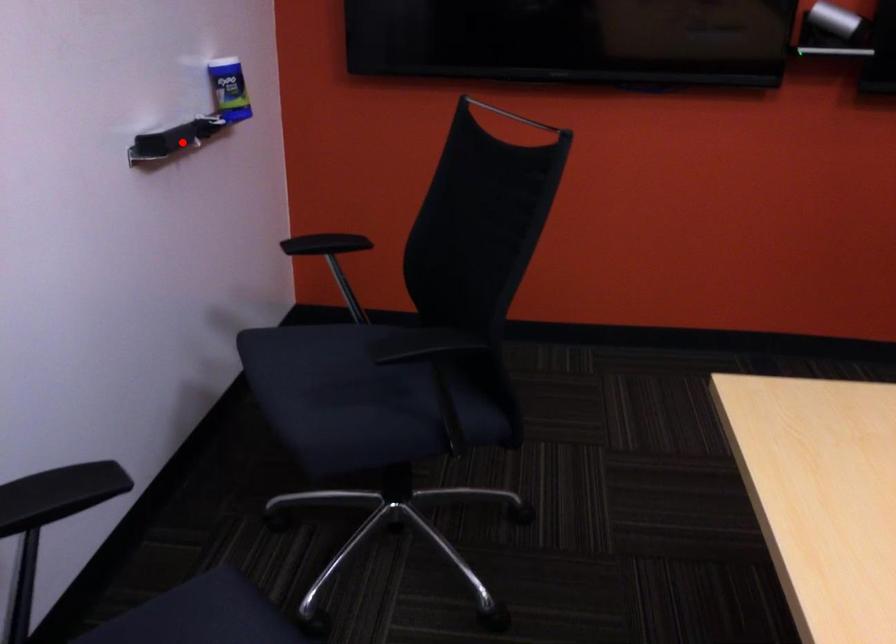
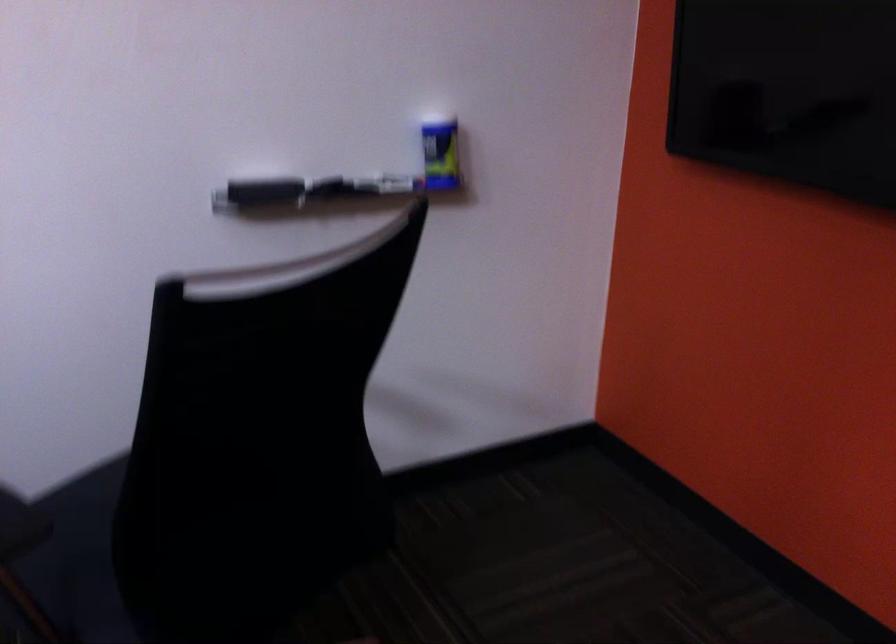
Question: I am providing you with two images of the same scene from different viewpoints. A red point is marked on the first image. At the location where the point appears in image 1, is it still visible in image 2?

Choices:
 (A) Yes
 (B) No

Answer: (A)